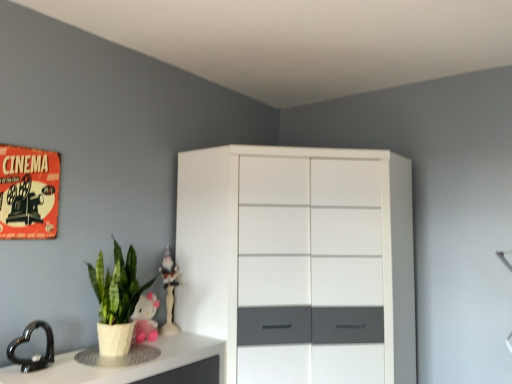
What do you see at coordinates (298, 262) in the screenshot?
I see `white glossy cabinet at center` at bounding box center [298, 262].

This screenshot has width=512, height=384. What are the coordinates of `green matte plant at lower left` in the screenshot? It's located at (116, 301).

At what (x,y) coordinates should I click in order to perform the action: click on white glossy cabinet at center. Please return your answer as a coordinate pair (x, y). The image size is (512, 384). Looking at the image, I should click on (298, 262).

Which is more to the left, green matte plant at lower left or white glossy cabinet at center?

From the viewer's perspective, green matte plant at lower left appears more on the left side.

Relative to white glossy cabinet at center, is green matte plant at lower left in front or behind?

green matte plant at lower left is behind white glossy cabinet at center.

Is green matte plant at lower left located outside white glossy cabinet at center?

That's correct, green matte plant at lower left is outside of white glossy cabinet at center.

Does point (170, 309) appear closer or farther from the camera than point (103, 305)?

Point (170, 309) is farther from the camera than point (103, 305).

Which object is wider, white glossy figurine at upper center, the 1th toy positioned from the back, or green matte plant at lower left?

green matte plant at lower left is wider.

Is white glossy figurine at upper center, which is counted as the 2th toy, starting from the front, far away from green matte plant at lower left?

No.

Consider the image. Is green matte plant at lower left a part of white glossy figurine at upper center, the 1th toy positioned from the back?

No, green matte plant at lower left is not a part of white glossy figurine at upper center, the 1th toy positioned from the back.

Which is correct: pink plush toy at lower left, the 2th toy viewed from the back, is inside white glossy figurine at upper center, which is counted as the 2th toy, starting from the front, or outside of it?

pink plush toy at lower left, the 2th toy viewed from the back, lies outside white glossy figurine at upper center, which is counted as the 2th toy, starting from the front.

Does pink plush toy at lower left, the 2th toy viewed from the back, lie in front of white glossy figurine at upper center, the 1th toy positioned from the back?

Yes, pink plush toy at lower left, the 2th toy viewed from the back, is in front of white glossy figurine at upper center, the 1th toy positioned from the back.

Identify the location of toy lying in front of the white glossy figurine at upper center, which is counted as the 2th toy, starting from the front. Image resolution: width=512 pixels, height=384 pixels. (145, 318).

Consider the image. How different are the orientations of pink plush toy at lower left, the 2th toy viewed from the back, and green matte plant at lower left in degrees?

The angle between the facing direction of pink plush toy at lower left, the 2th toy viewed from the back, and the facing direction of green matte plant at lower left is 8.46 degrees.

Is green matte plant at lower left located within pink plush toy at lower left, marked as the 1th toy in a front-to-back arrangement?

Actually, green matte plant at lower left is outside pink plush toy at lower left, marked as the 1th toy in a front-to-back arrangement.

Is pink plush toy at lower left, marked as the 1th toy in a front-to-back arrangement, taller or shorter than green matte plant at lower left?

Considering their sizes, pink plush toy at lower left, marked as the 1th toy in a front-to-back arrangement, has less height than green matte plant at lower left.

In the scene shown: From the image's perspective, does pink plush toy at lower left, marked as the 1th toy in a front-to-back arrangement, appear higher than green matte plant at lower left?

No, from the image's perspective, pink plush toy at lower left, marked as the 1th toy in a front-to-back arrangement, is not over green matte plant at lower left.

Does point (168, 318) come closer to viewer compared to point (143, 372)?

No, (168, 318) is behind (143, 372).

Would you say white glossy figurine at upper center, which is counted as the 2th toy, starting from the front, is inside or outside white glossy counter top at lower left?

white glossy figurine at upper center, which is counted as the 2th toy, starting from the front, cannot be found inside white glossy counter top at lower left.

Can you confirm if white glossy figurine at upper center, which is counted as the 2th toy, starting from the front, is bigger than white glossy counter top at lower left?

Incorrect, white glossy figurine at upper center, which is counted as the 2th toy, starting from the front, is not larger than white glossy counter top at lower left.

From a real-world perspective, is white glossy figurine at upper center, which is counted as the 2th toy, starting from the front, physically above white glossy counter top at lower left?

Indeed, from a real-world perspective, white glossy figurine at upper center, which is counted as the 2th toy, starting from the front, stands above white glossy counter top at lower left.

Which is behind, point (148, 307) or point (30, 323)?

The point (148, 307) is behind.

Does pink plush toy at lower left, the 2th toy viewed from the back, have a greater width compared to black glossy heart at lower left?

Correct, the width of pink plush toy at lower left, the 2th toy viewed from the back, exceeds that of black glossy heart at lower left.

In order to click on faucet above the pink plush toy at lower left, marked as the 1th toy in a front-to-back arrangement (from the image's perspective) in this screenshot , I will do `click(28, 341)`.

Between pink plush toy at lower left, marked as the 1th toy in a front-to-back arrangement, and white glossy counter top at lower left, which one has smaller width?

pink plush toy at lower left, marked as the 1th toy in a front-to-back arrangement, is thinner.

Considering the points (146, 337) and (184, 343), which point is behind, point (146, 337) or point (184, 343)?

Positioned behind is point (184, 343).

How different are the orientations of pink plush toy at lower left, marked as the 1th toy in a front-to-back arrangement, and white glossy counter top at lower left in degrees?

The facing directions of pink plush toy at lower left, marked as the 1th toy in a front-to-back arrangement, and white glossy counter top at lower left are 8.46 degrees apart.

Is pink plush toy at lower left, marked as the 1th toy in a front-to-back arrangement, behind white glossy counter top at lower left?

That is True.

This screenshot has width=512, height=384. I want to click on the chest of drawers lying in front of the green matte plant at lower left, so click(298, 262).

At what (x,y) coordinates should I click in order to perform the action: click on houseplant on the left of white glossy figurine at upper center, which is counted as the 2th toy, starting from the front. Please return your answer as a coordinate pair (x, y). Looking at the image, I should click on (116, 301).

From the image, which object appears to be nearer to pink plush toy at lower left, marked as the 1th toy in a front-to-back arrangement, white glossy counter top at lower left or white glossy figurine at upper center, the 1th toy positioned from the back?

Based on the image, white glossy figurine at upper center, the 1th toy positioned from the back, appears to be nearer to pink plush toy at lower left, marked as the 1th toy in a front-to-back arrangement.

Which object lies further to the anchor point black glossy heart at lower left, white glossy figurine at upper center, the 1th toy positioned from the back, or white glossy counter top at lower left?

white glossy figurine at upper center, the 1th toy positioned from the back.

From the image, which object appears to be nearer to white glossy figurine at upper center, which is counted as the 2th toy, starting from the front, pink plush toy at lower left, marked as the 1th toy in a front-to-back arrangement, or black glossy heart at lower left?

pink plush toy at lower left, marked as the 1th toy in a front-to-back arrangement, is closer to white glossy figurine at upper center, which is counted as the 2th toy, starting from the front.

From the image, which object appears to be farther from white glossy cabinet at center, white glossy counter top at lower left or pink plush toy at lower left, marked as the 1th toy in a front-to-back arrangement?

The object further to white glossy cabinet at center is pink plush toy at lower left, marked as the 1th toy in a front-to-back arrangement.

Which object lies further to the anchor point black glossy heart at lower left, white glossy counter top at lower left or white glossy cabinet at center?

white glossy cabinet at center is further to black glossy heart at lower left.

From the image, which object appears to be farther from white glossy figurine at upper center, which is counted as the 2th toy, starting from the front, white glossy cabinet at center or black glossy heart at lower left?

black glossy heart at lower left is further to white glossy figurine at upper center, which is counted as the 2th toy, starting from the front.

Considering their positions, is white glossy cabinet at center positioned closer to white glossy figurine at upper center, the 1th toy positioned from the back, than green matte plant at lower left?

Among the two, green matte plant at lower left is located nearer to white glossy figurine at upper center, the 1th toy positioned from the back.

Considering their positions, is black glossy heart at lower left positioned further to green matte plant at lower left than white glossy cabinet at center?

Among the two, white glossy cabinet at center is located further to green matte plant at lower left.

Identify the location of houseplant located between black glossy heart at lower left and pink plush toy at lower left, the 2th toy viewed from the back, in the depth direction. (116, 301).

Locate an element on the screen. The width and height of the screenshot is (512, 384). toy between black glossy heart at lower left and white glossy figurine at upper center, the 1th toy positioned from the back, from front to back is located at coordinates (145, 318).

The image size is (512, 384). I want to click on toy located between pink plush toy at lower left, marked as the 1th toy in a front-to-back arrangement, and white glossy cabinet at center in the left-right direction, so click(x=169, y=292).

At what (x,y) coordinates should I click in order to perform the action: click on toy between green matte plant at lower left and white glossy figurine at upper center, which is counted as the 2th toy, starting from the front, in the front-back direction. Please return your answer as a coordinate pair (x, y). The height and width of the screenshot is (384, 512). Looking at the image, I should click on (145, 318).